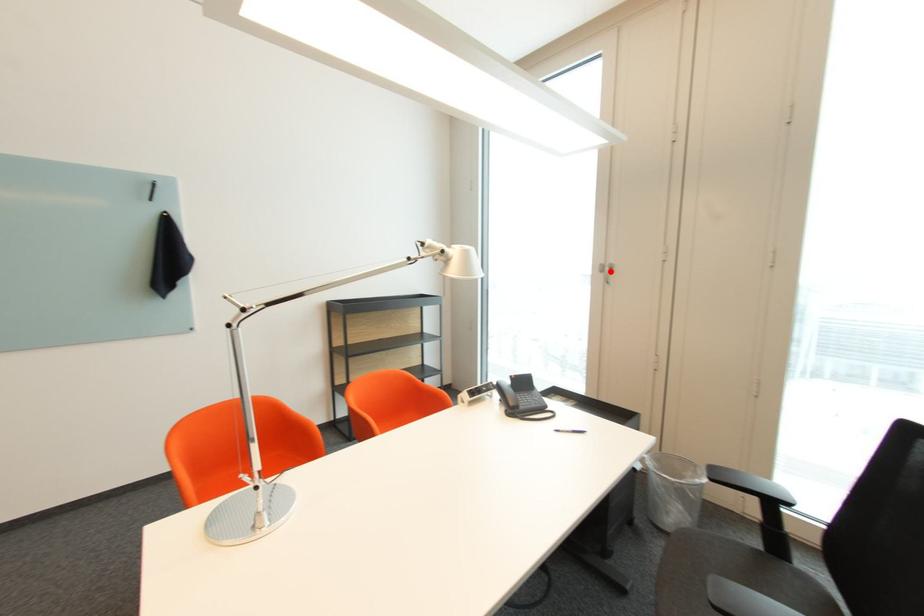
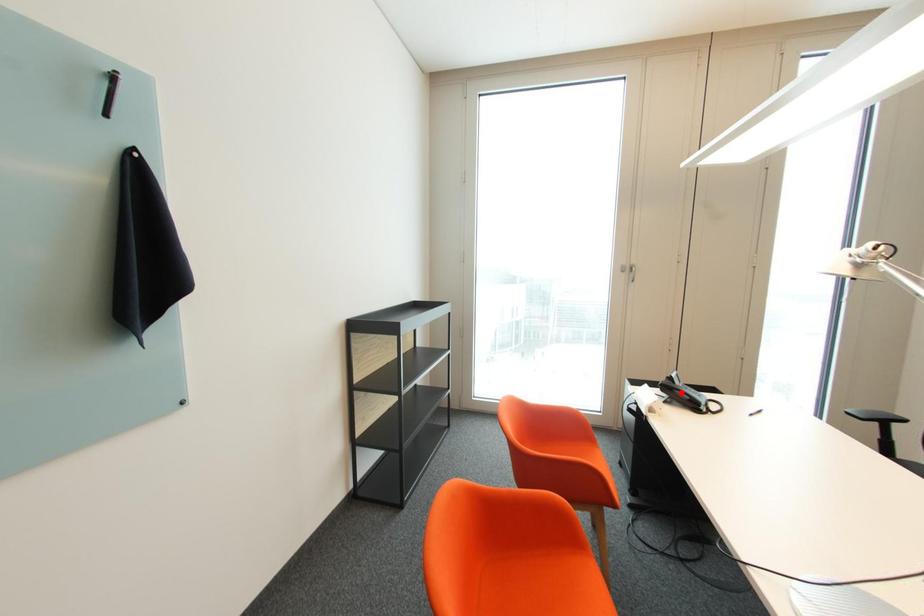
I am providing you with two images of the same scene from different viewpoints. A red point is marked on the first image and another point is marked on the second image. Is the red point in image1 aligned with the point shown in image2?

No